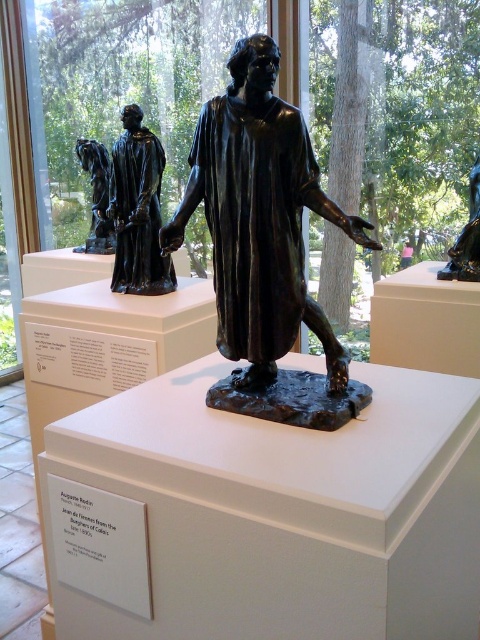
You are a museum visitor standing in front of the Rodin sculptures. You notice the shiny bronze statue at center and the bronze statue at left. Which statue is positioned lower in the display?

The shiny bronze statue at center is located below the bronze statue at left, so it is positioned lower in the display.

You are an art student standing in front of the museum display. You notice two points marked on the floor in front of the sculptures. The first point is at coordinates point (339,385) and the second is at point (84,147). If you were to walk from the first point to the second point, would you be moving towards the sculptures or away from them?

Since point (339,385) is in front of point (84,147), moving from the first point to the second point would mean moving away from the sculptures.

Where is the shiny bronze statue at left located in the museum display?

The shiny bronze statue at left is located at point (137, 209) in the museum display.